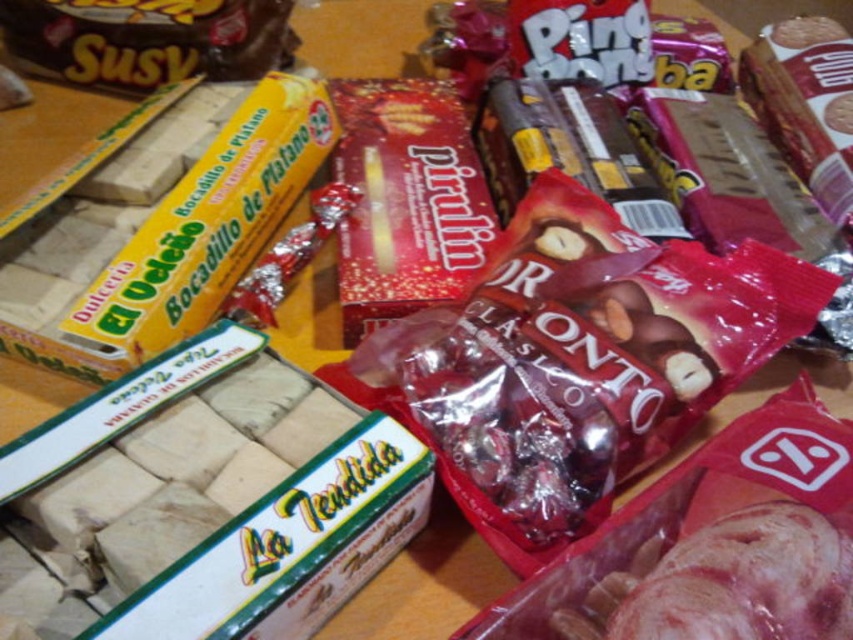
Question: Among these points, which one is farthest from the camera?

Choices:
 (A) (827, 595)
 (B) (189, 19)

Answer: (B)

Question: Among these points, which one is farthest from the camera?

Choices:
 (A) (27, 40)
 (B) (560, 616)

Answer: (A)

Question: Is marbled pinkish-red meat at lower right smaller than brown matte chocolate bar at upper left?

Choices:
 (A) no
 (B) yes

Answer: (B)

Question: Which of the following is the farthest from the observer?

Choices:
 (A) marbled pinkish-red meat at lower right
 (B) brown matte chocolate bar at upper left

Answer: (B)

Question: Can you confirm if marbled pinkish-red meat at lower right is wider than brown matte chocolate bar at upper left?

Choices:
 (A) yes
 (B) no

Answer: (B)

Question: Does marbled pinkish-red meat at lower right appear on the right side of brown matte chocolate bar at upper left?

Choices:
 (A) yes
 (B) no

Answer: (A)